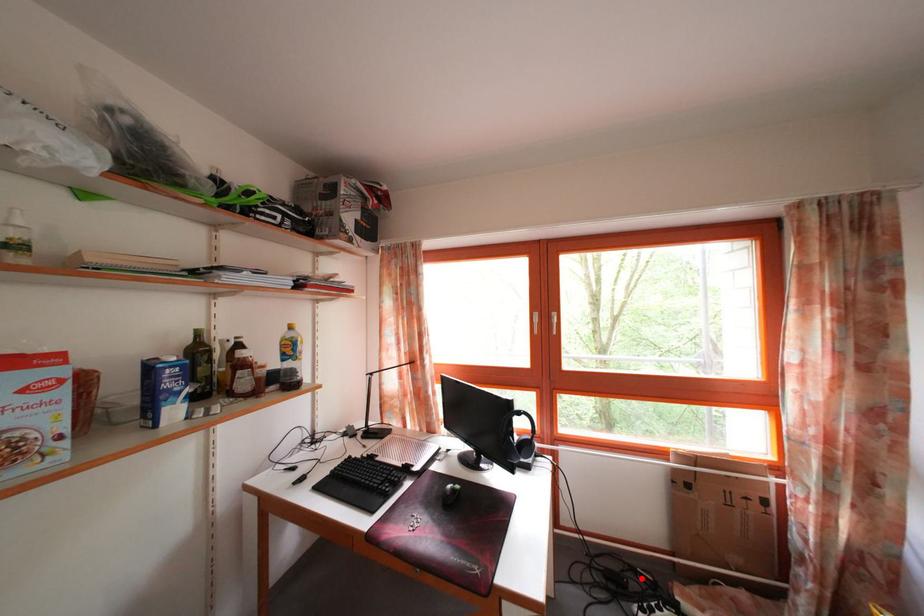
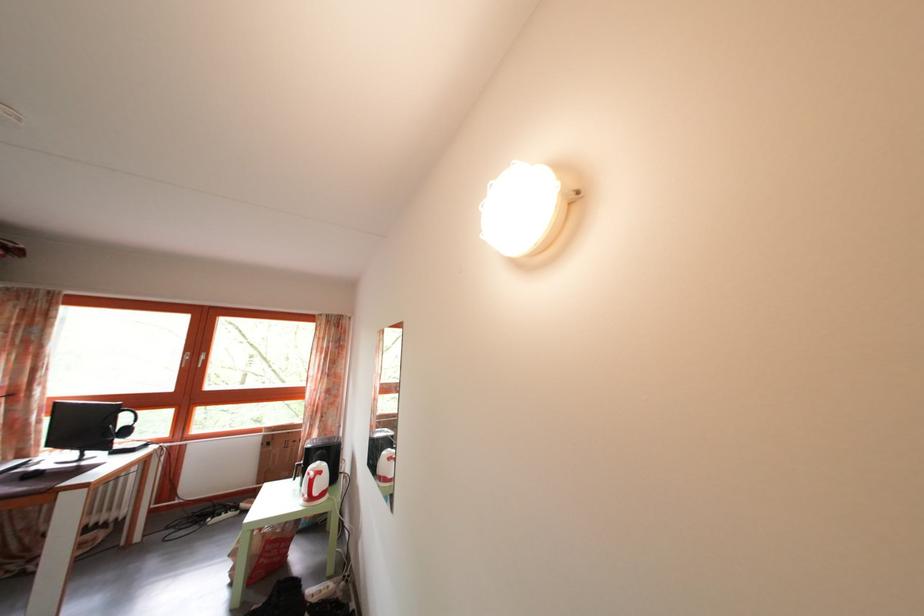
Question: I am providing you with two images of the same scene from different viewpoints. Image1 has a red point marked. In image2, the corresponding 3D location appears at what relative position? Reply with the corresponding letter.

Choices:
 (A) Closer
 (B) Farther

Answer: (A)